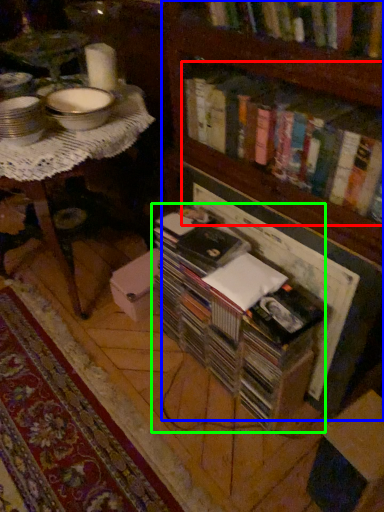
Question: Based on their relative distances, which object is nearer to book (highlighted by a red box)? Choose from bookcase (highlighted by a blue box) and book (highlighted by a green box).

Choices:
 (A) bookcase
 (B) book

Answer: (A)